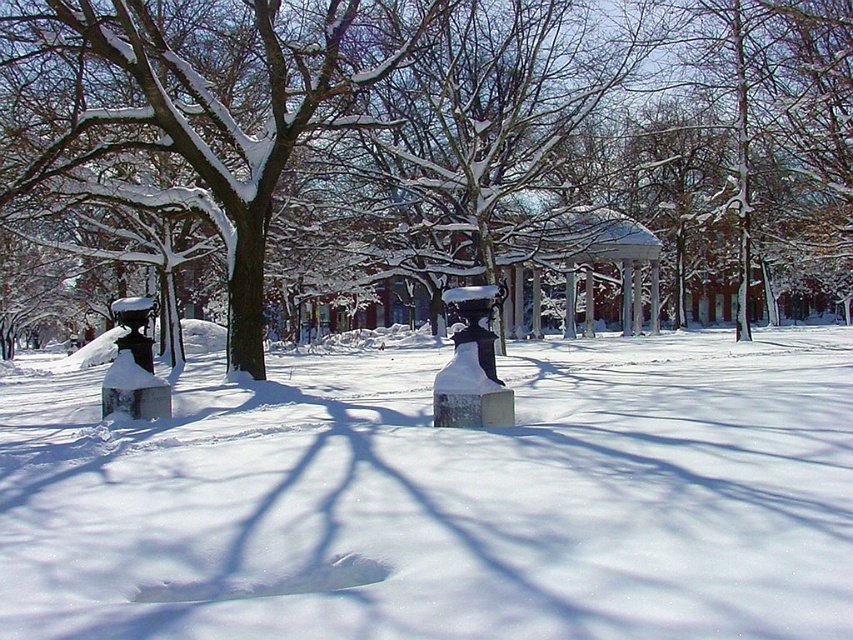
Is white matte snow at center smaller than snow-covered tree at center?

Indeed, white matte snow at center has a smaller size compared to snow-covered tree at center.

Between point (567, 614) and point (456, 248), which one is positioned behind?

Point (456, 248)

What are the coordinates of `white matte snow at center` in the screenshot? It's located at (444, 499).